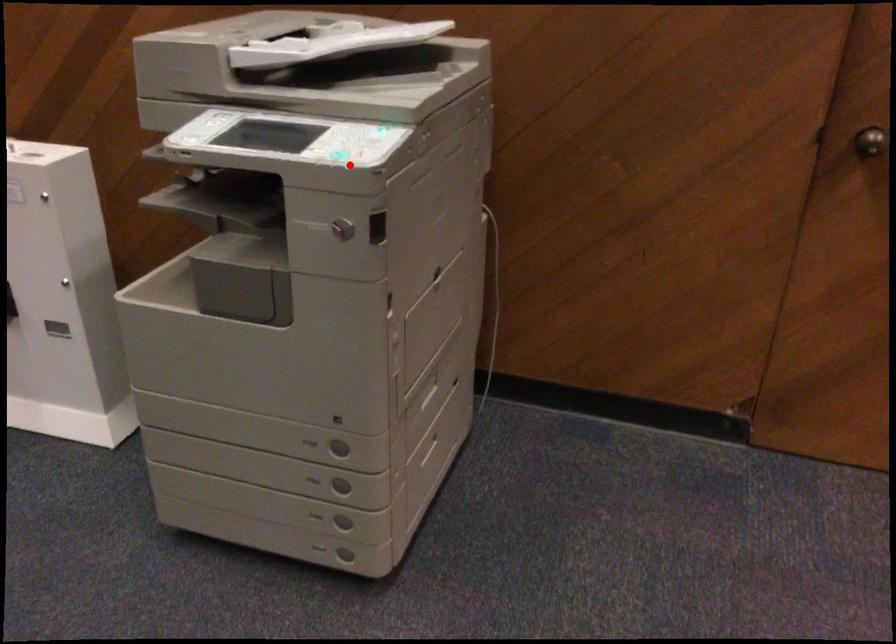
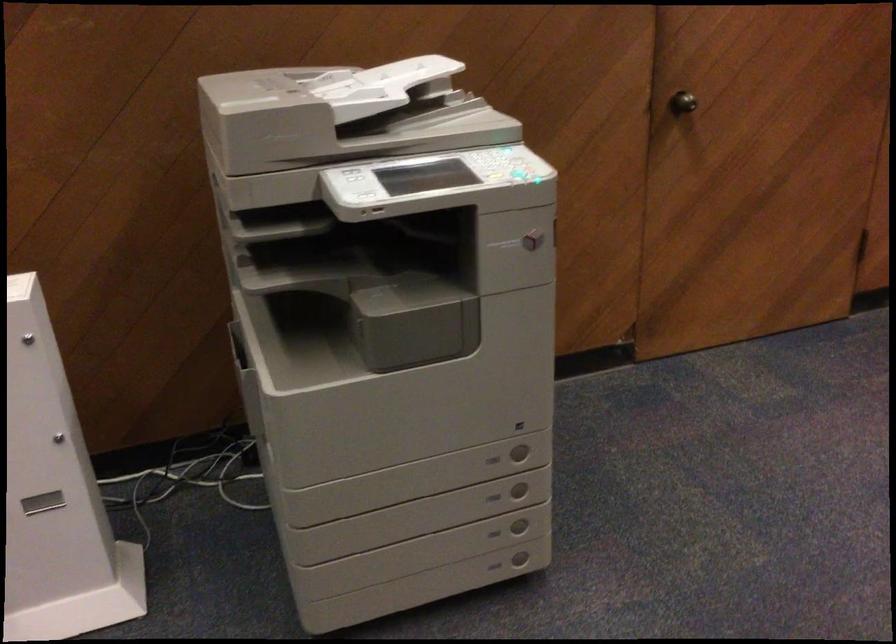
In the second image, find the point that corresponds to the highlighted location in the first image.

(521, 176)